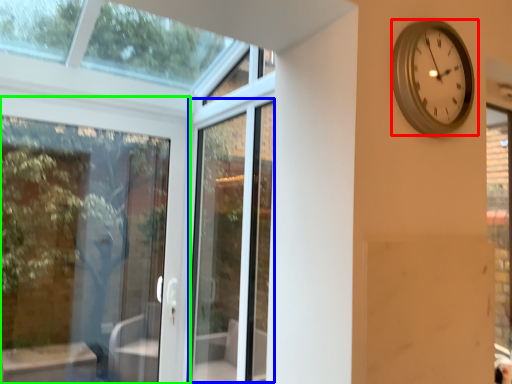
Question: Considering the real-world distances, which object is farthest from wall clock (highlighted by a red box)? screen door (highlighted by a blue box) or door (highlighted by a green box)?

Choices:
 (A) screen door
 (B) door

Answer: (B)